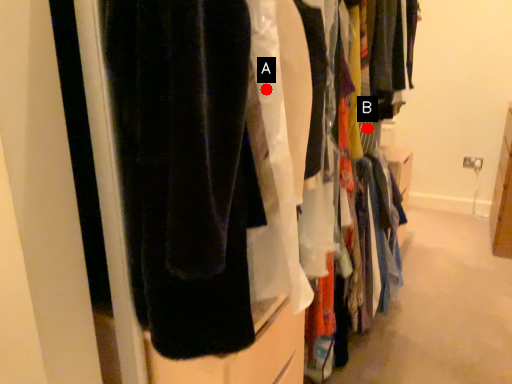
Question: Two points are circled on the image, labeled by A and B beside each circle. Which point is closer to the camera?

Choices:
 (A) A is closer
 (B) B is closer

Answer: (A)